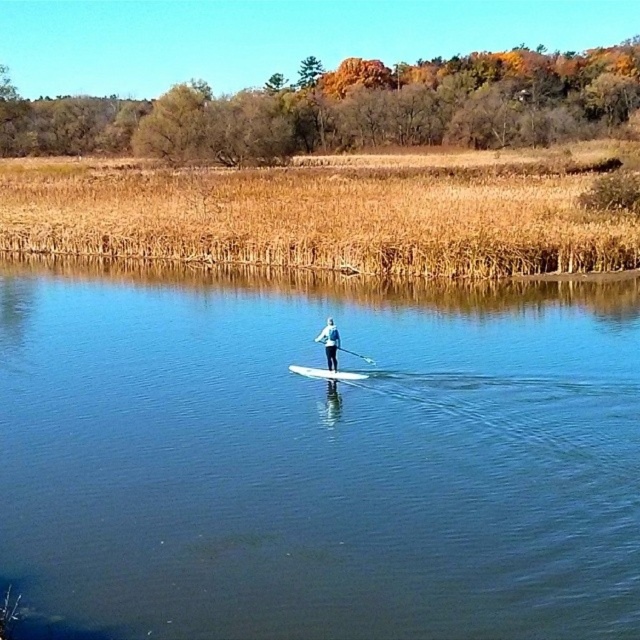
Which is below, clear blue water at center or white foam surfboard at center?

Positioned lower is white foam surfboard at center.

Can you confirm if clear blue water at center is smaller than white foam surfboard at center?

Incorrect, clear blue water at center is not smaller in size than white foam surfboard at center.

Find the location of `clear blue water at center`. clear blue water at center is located at coordinates (317, 458).

The width and height of the screenshot is (640, 640). Find the location of `clear blue water at center`. clear blue water at center is located at coordinates (317, 458).

Which is in front, point (406, 509) or point (323, 339)?

Point (406, 509)

Is point (522, 504) closer to camera compared to point (323, 339)?

That is True.

Find the location of `clear blue water at center`. clear blue water at center is located at coordinates (317, 458).

Does clear blue water at center appear over white glossy paddle at center?

No.

Who is more distant from viewer, (248, 580) or (365, 356)?

The point (365, 356) is more distant.

Find the location of a particular element. The image size is (640, 640). clear blue water at center is located at coordinates (317, 458).